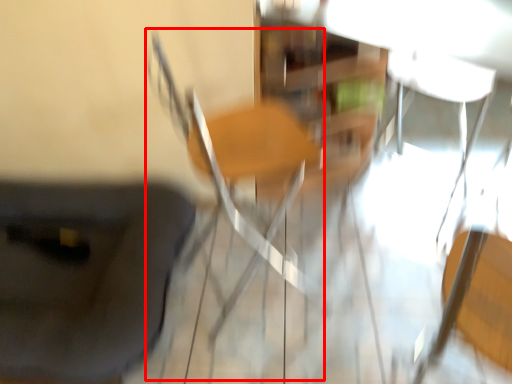
Question: From the image's perspective, what is the correct spatial positioning of chair (annotated by the red box) in reference to furniture?

Choices:
 (A) above
 (B) below

Answer: (A)